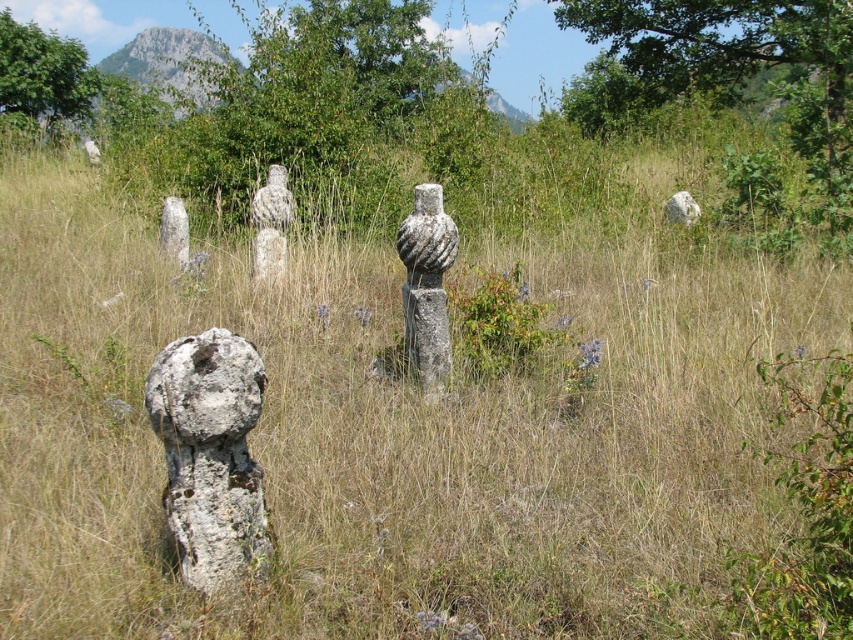
You are an archaeologist examining the ancient stone structures in the field. You notice the speckled stone vase at center and the gray rough stone at center. Which one appears nearer to you?

The speckled stone vase at center is closer to the viewer than the gray rough stone at center, so the speckled stone vase at center appears nearer.